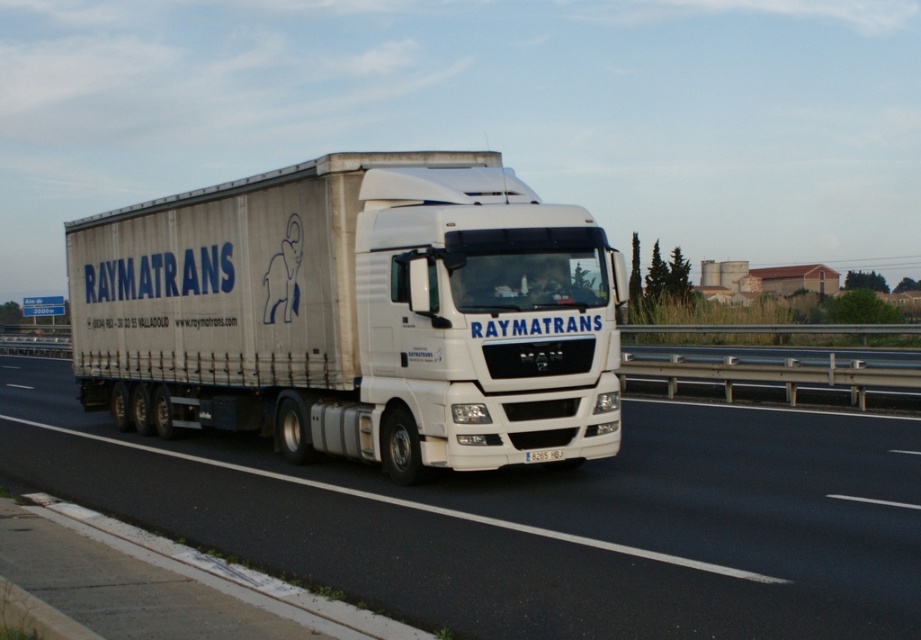
You are a traffic officer observing two trucks on the highway. You see a white glossy truck at center and a white matte truck at center. Which truck is closer to the right edge of the road?

The white glossy truck at center is positioned on the right side of the white matte truck at center, so it is closer to the right edge of the road.

You are a traffic officer observing a highway. You notice a white glossy truck at center. Where exactly is it positioned on the highway according to the coordinate system provided?

The white glossy truck at center is located at point (535, 520) in the coordinate system.